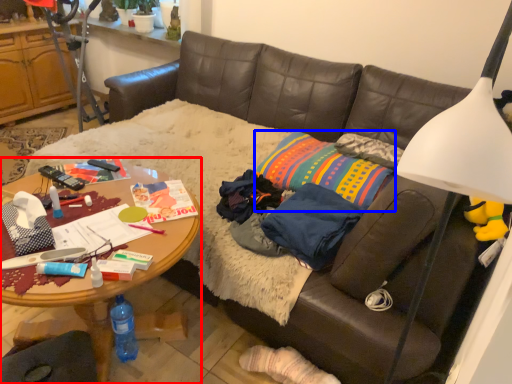
Question: Which object appears closest to the camera in this image, desk (highlighted by a red box) or pillow (highlighted by a blue box)?

Choices:
 (A) desk
 (B) pillow

Answer: (A)